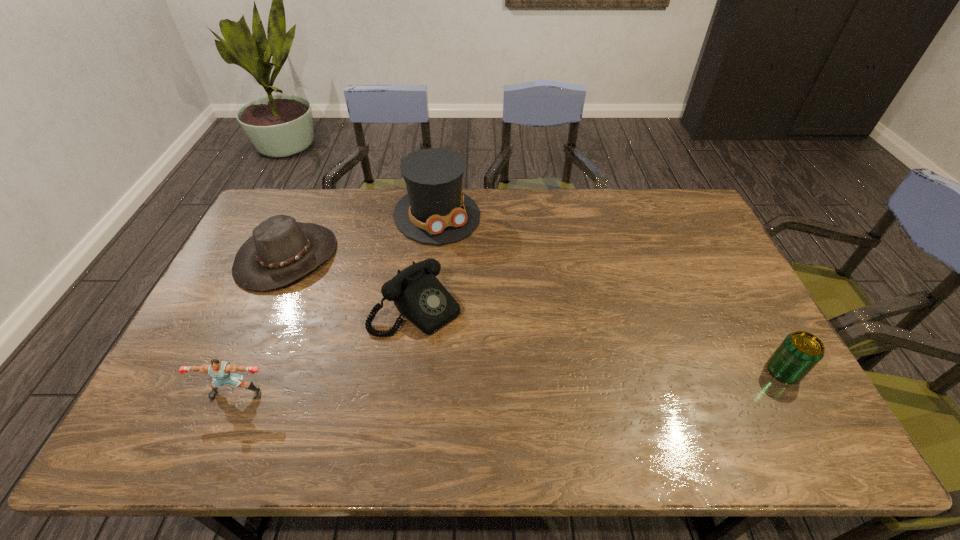
Where is `vacant region that satisfies the following two spatial constraints: 1. on the front side of the tallest object; 2. on the left side of the rightmost object`? vacant region that satisfies the following two spatial constraints: 1. on the front side of the tallest object; 2. on the left side of the rightmost object is located at coordinates (420, 372).

Where is `free space that satisfies the following two spatial constraints: 1. on the front side of the hat; 2. on the left side of the beer can`? The height and width of the screenshot is (540, 960). free space that satisfies the following two spatial constraints: 1. on the front side of the hat; 2. on the left side of the beer can is located at coordinates (235, 372).